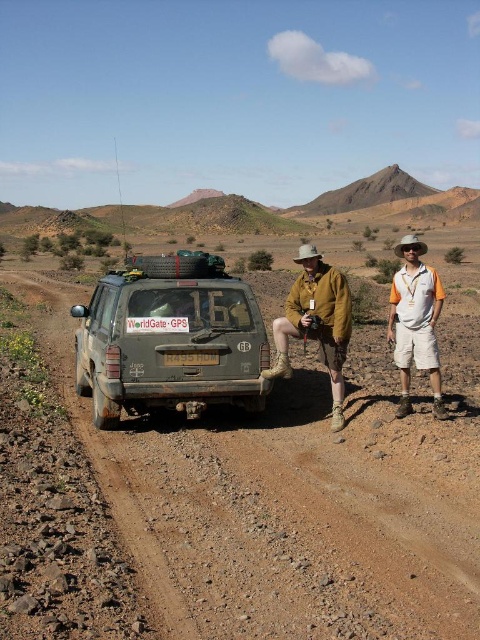
Question: Considering the real-world distances, which object is farthest from the white plastic license plate at rear?

Choices:
 (A) brown gravel dirt track at center
 (B) white cotton shorts at right
 (C) camouflage fabric jacket at center
 (D) dirty gray mud at center

Answer: (B)

Question: Can you confirm if camouflage fabric jacket at center is thinner than white cotton shorts at right?

Choices:
 (A) no
 (B) yes

Answer: (A)

Question: Estimate the real-world distances between objects in this image. Which object is closer to the dirty gray mud at center?

Choices:
 (A) white cotton shorts at right
 (B) brown gravel dirt track at center
 (C) white plastic license plate at rear

Answer: (C)

Question: Which point is farther to the camera?

Choices:
 (A) (x=112, y=378)
 (B) (x=440, y=406)

Answer: (A)

Question: Is dirty gray mud at center positioned at the back of brown suede jacket at center?

Choices:
 (A) no
 (B) yes

Answer: (A)

Question: Does dirty gray mud at center appear on the right side of white plastic license plate at rear?

Choices:
 (A) no
 (B) yes

Answer: (A)